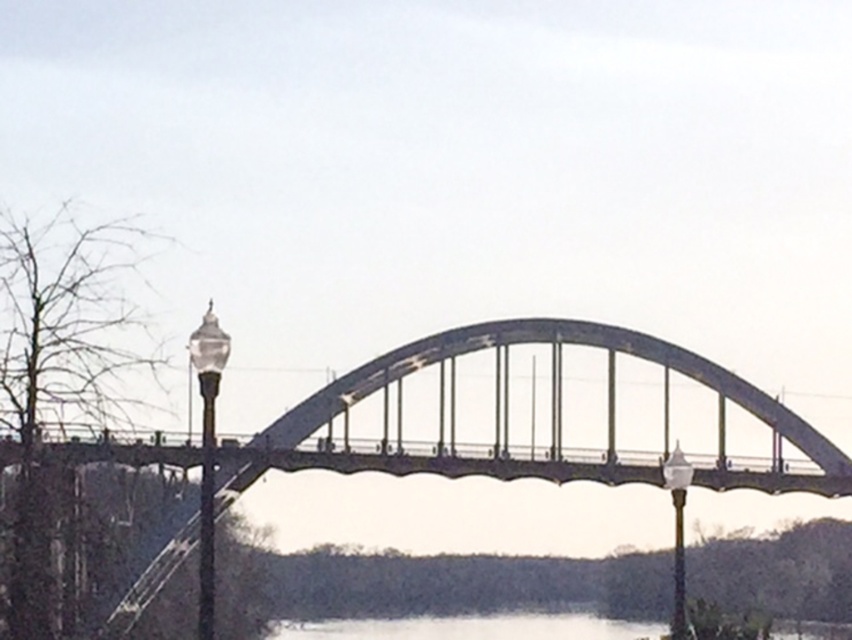
Does clear glass lamp post at left appear on the left side of white glass lamp post at center?

Correct, you'll find clear glass lamp post at left to the left of white glass lamp post at center.

Is point (208, 593) positioned before point (678, 548)?

Yes, it is in front of point (678, 548).

Identify the location of clear glass lamp post at left. (206, 452).